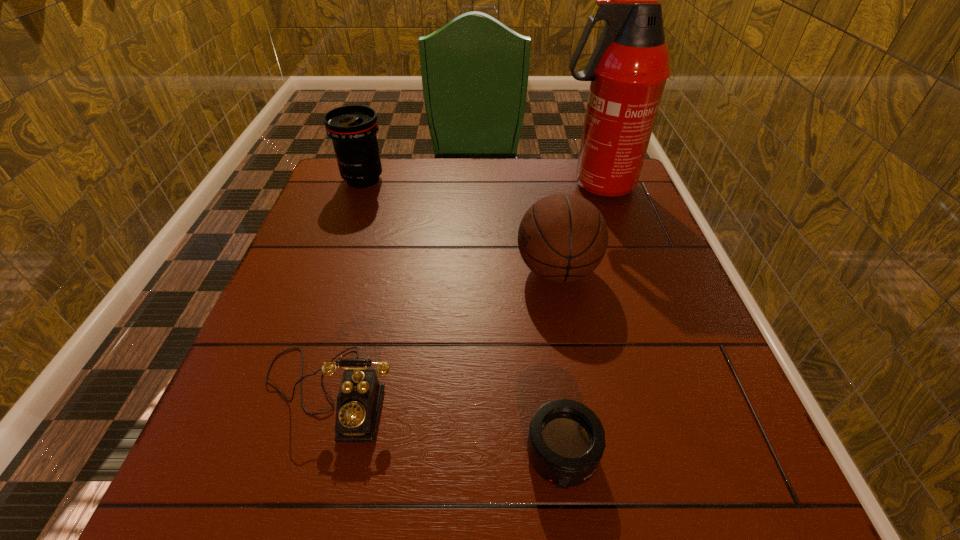
The width and height of the screenshot is (960, 540). What are the coordinates of `free space between the fire extinguisher and the nearer telephoto lens` in the screenshot? It's located at (579, 320).

Locate an element on the screen. The height and width of the screenshot is (540, 960). empty space that is in between the shortest object and the basketball is located at coordinates (560, 363).

Where is `vacant space that's between the taller telephoto lens and the fire extinguisher`? vacant space that's between the taller telephoto lens and the fire extinguisher is located at coordinates (480, 182).

The width and height of the screenshot is (960, 540). I want to click on free spot between the tallest object and the fourth tallest object, so click(463, 288).

This screenshot has width=960, height=540. Find the location of `vacant point located between the taller telephoto lens and the third farthest object`. vacant point located between the taller telephoto lens and the third farthest object is located at coordinates (460, 225).

Identify the location of vacant space that is in between the tallest object and the telephone. This screenshot has width=960, height=540. (463, 288).

Where is `free space between the shorter telephoto lens and the second shortest object`? free space between the shorter telephoto lens and the second shortest object is located at coordinates (445, 424).

This screenshot has width=960, height=540. Identify the location of unoccupied position between the telephone and the taller telephoto lens. (346, 286).

Identify which object is the fourth nearest to the basketball. Please provide its 2D coordinates. Your answer should be formatted as a tuple, i.e. [(x, y)], where the tuple contains the x and y coordinates of a point satisfying the conditions above.

[(352, 128)]

Identify which object is the nearest to the nearer telephoto lens. Please provide its 2D coordinates. Your answer should be formatted as a tuple, i.e. [(x, y)], where the tuple contains the x and y coordinates of a point satisfying the conditions above.

[(360, 395)]